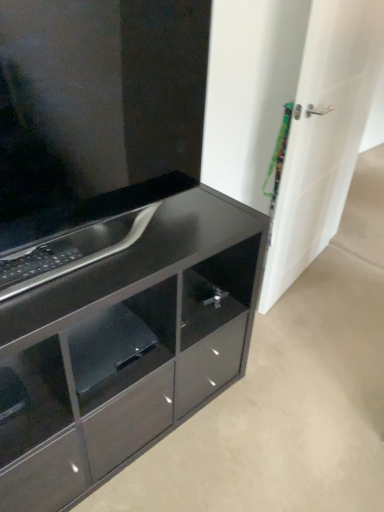
Question: Can you confirm if glossy black cabinet at center is wider than glossy black shelf at lower center?

Choices:
 (A) no
 (B) yes

Answer: (A)

Question: Does glossy black cabinet at center have a lesser height compared to glossy black shelf at lower center?

Choices:
 (A) yes
 (B) no

Answer: (B)

Question: Would you say glossy black cabinet at center is a long distance from glossy black shelf at lower center?

Choices:
 (A) yes
 (B) no

Answer: (B)

Question: Does glossy black cabinet at center come in front of glossy black shelf at lower center?

Choices:
 (A) yes
 (B) no

Answer: (A)

Question: Considering the relative sizes of glossy black cabinet at center and glossy black shelf at lower center in the image provided, is glossy black cabinet at center thinner than glossy black shelf at lower center?

Choices:
 (A) no
 (B) yes

Answer: (B)

Question: Does glossy black cabinet at center appear on the right side of glossy black shelf at lower center?

Choices:
 (A) no
 (B) yes

Answer: (B)

Question: Can you confirm if white glossy door at right is shorter than glossy black cabinet at center?

Choices:
 (A) no
 (B) yes

Answer: (A)

Question: Is white glossy door at right facing towards glossy black cabinet at center?

Choices:
 (A) no
 (B) yes

Answer: (A)

Question: Does white glossy door at right appear on the right side of glossy black cabinet at center?

Choices:
 (A) yes
 (B) no

Answer: (A)

Question: Is white glossy door at right smaller than glossy black cabinet at center?

Choices:
 (A) yes
 (B) no

Answer: (B)

Question: Is white glossy door at right thinner than glossy black cabinet at center?

Choices:
 (A) yes
 (B) no

Answer: (A)

Question: From a real-world perspective, is white glossy door at right on top of glossy black cabinet at center?

Choices:
 (A) yes
 (B) no

Answer: (B)

Question: From the image's perspective, does white glossy door at right appear lower than glossy black cabinet at lower left?

Choices:
 (A) yes
 (B) no

Answer: (B)